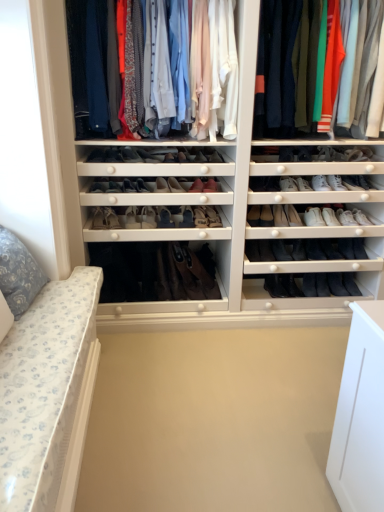
Question: From the image's perspective, does brown suede boot at center appear lower than floral fabric pillow at left?

Choices:
 (A) yes
 (B) no

Answer: (A)

Question: Are brown suede boot at center and floral fabric pillow at left making contact?

Choices:
 (A) yes
 (B) no

Answer: (B)

Question: Does brown suede boot at center turn towards floral fabric pillow at left?

Choices:
 (A) no
 (B) yes

Answer: (A)

Question: Considering the relative sizes of brown suede boot at center and floral fabric pillow at left in the image provided, is brown suede boot at center taller than floral fabric pillow at left?

Choices:
 (A) yes
 (B) no

Answer: (B)

Question: Is brown suede boot at center oriented away from floral fabric pillow at left?

Choices:
 (A) yes
 (B) no

Answer: (B)

Question: From the image's perspective, relative to leather boot at center, which ranks as the eleventh shoe in right-to-left order, is leather boot at center, which appears as the sixteenth shoe when viewed from the right, above or below?

Choices:
 (A) below
 (B) above

Answer: (A)

Question: Relative to leather boot at center, which ranks as the eleventh shoe in right-to-left order, is leather boot at center, which appears as the sixteenth shoe when viewed from the right, in front or behind?

Choices:
 (A) front
 (B) behind

Answer: (B)

Question: In terms of size, does leather boot at center, which is the ninth shoe in left-to-right order, appear bigger or smaller than leather boot at center, which ranks as the eleventh shoe in right-to-left order?

Choices:
 (A) big
 (B) small

Answer: (A)

Question: From their relative heights in the image, would you say leather boot at center, which appears as the sixteenth shoe when viewed from the right, is taller or shorter than leather boot at center, which ranks as the eleventh shoe in right-to-left order?

Choices:
 (A) tall
 (B) short

Answer: (A)

Question: Considering the positions of black suede shoe at lower center, which ranks as the second shoe in right-to-left order, and black leather boot at lower center, acting as the 21th shoe starting from the left, in the image, is black suede shoe at lower center, which ranks as the second shoe in right-to-left order, wider or thinner than black leather boot at lower center, acting as the 21th shoe starting from the left,?

Choices:
 (A) thin
 (B) wide

Answer: (A)

Question: Considering the relative positions of black suede shoe at lower center, which ranks as the second shoe in right-to-left order, and black leather boot at lower center, acting as the 21th shoe starting from the left, in the image provided, is black suede shoe at lower center, which ranks as the second shoe in right-to-left order, to the left or to the right of black leather boot at lower center, acting as the 21th shoe starting from the left,?

Choices:
 (A) right
 (B) left

Answer: (A)

Question: Relative to black leather boot at lower center, acting as the 21th shoe starting from the left, is black suede shoe at lower center, the 23th shoe in the left-to-right sequence, in front or behind?

Choices:
 (A) front
 (B) behind

Answer: (B)

Question: Would you say black suede shoe at lower center, which ranks as the second shoe in right-to-left order, is inside or outside black leather boot at lower center, acting as the 21th shoe starting from the left?

Choices:
 (A) inside
 (B) outside

Answer: (B)

Question: Does point [163, 211] appear closer or farther from the camera than point [124, 155]?

Choices:
 (A) closer
 (B) farther

Answer: (B)

Question: Is leather boot at center, positioned as the thirteenth shoe in right-to-left order, spatially inside matte black shoe at center, which is the eighth shoe from left to right, or outside of it?

Choices:
 (A) outside
 (B) inside

Answer: (A)